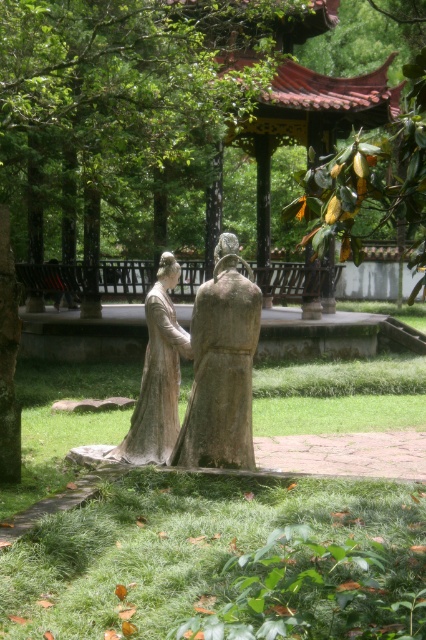
Question: Is matte stone statues at center positioned in front of matte stone statue at center?

Choices:
 (A) yes
 (B) no

Answer: (A)

Question: Which point is farther to the camera?

Choices:
 (A) matte stone statues at center
 (B) matte stone statue at center

Answer: (B)

Question: Is matte stone statues at center further to camera compared to matte stone statue at center?

Choices:
 (A) no
 (B) yes

Answer: (A)

Question: Does matte stone statues at center appear under matte stone statue at center?

Choices:
 (A) yes
 (B) no

Answer: (A)

Question: Among these objects, which one is nearest to the camera?

Choices:
 (A) matte stone statues at center
 (B) matte stone statue at center

Answer: (A)